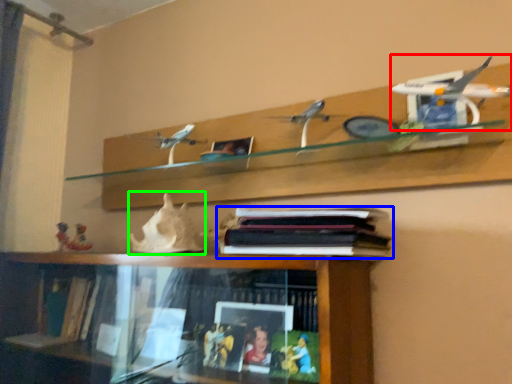
Question: Based on their relative distances, which object is nearer to aircraft model (highlighted by a red box)? Choose from book (highlighted by a blue box) and toy (highlighted by a green box).

Choices:
 (A) book
 (B) toy

Answer: (A)